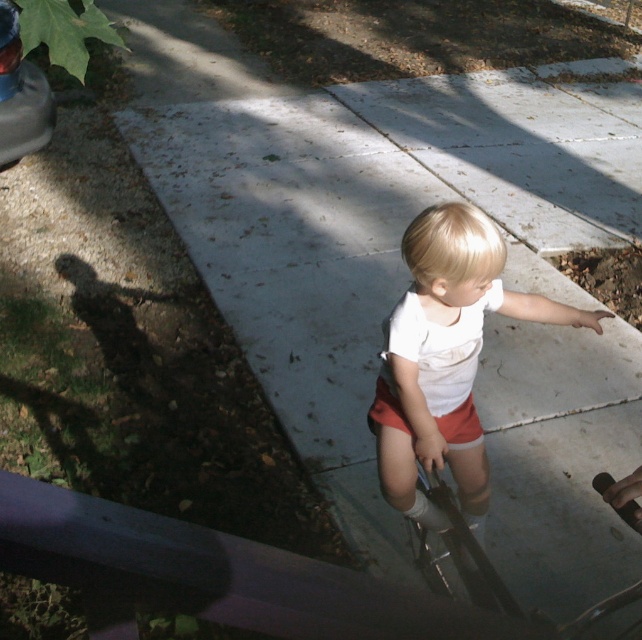
Does white matte shorts at center have a smaller size compared to shiny concrete puddle at lower right?

No, white matte shorts at center is not smaller than shiny concrete puddle at lower right.

Who is lower down, white matte shorts at center or shiny concrete puddle at lower right?

white matte shorts at center is lower down.

Who is more forward, (431,321) or (625,253)?

Positioned in front is point (431,321).

The width and height of the screenshot is (642, 640). What are the coordinates of `white matte shorts at center` in the screenshot? It's located at point(446,356).

Locate an element on the screen. Image resolution: width=642 pixels, height=640 pixels. white matte shorts at center is located at coordinates (446, 356).

Is point (478, 310) less distant than point (379, 412)?

Yes, point (478, 310) is closer to viewer.

You are a GUI agent. You are given a task and a screenshot of the screen. Output one action in this format:
    pyautogui.click(x=<x>, y=<y>)
    Task: Click on the white matte shorts at center
    
    Given the screenshot: What is the action you would take?
    pyautogui.click(x=446, y=356)

Describe the element at coordinates (607, 276) in the screenshot. I see `shiny concrete puddle at lower right` at that location.

Does shiny concrete puddle at lower right appear under orange cotton shorts at center?

No.

Locate an element on the screen. This screenshot has width=642, height=640. shiny concrete puddle at lower right is located at coordinates (607, 276).